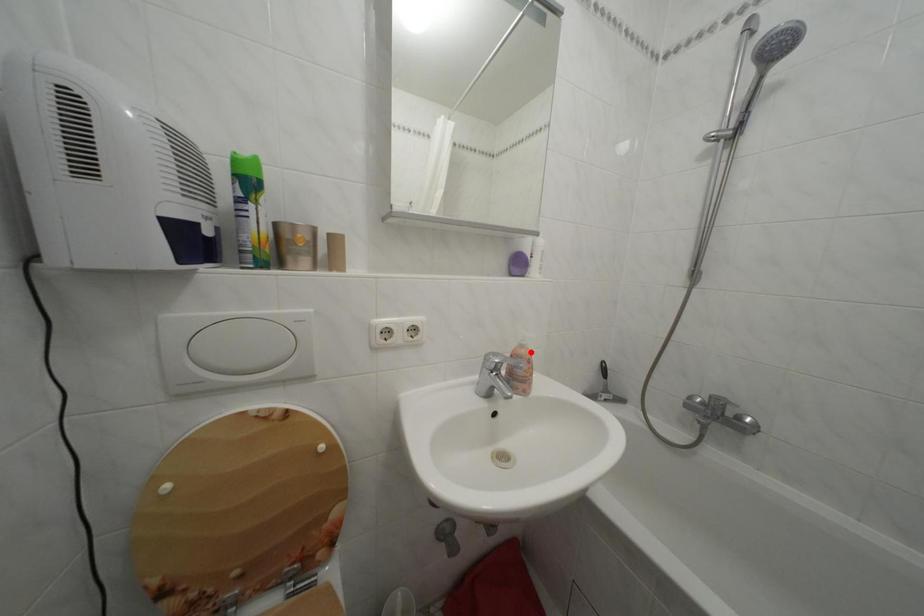
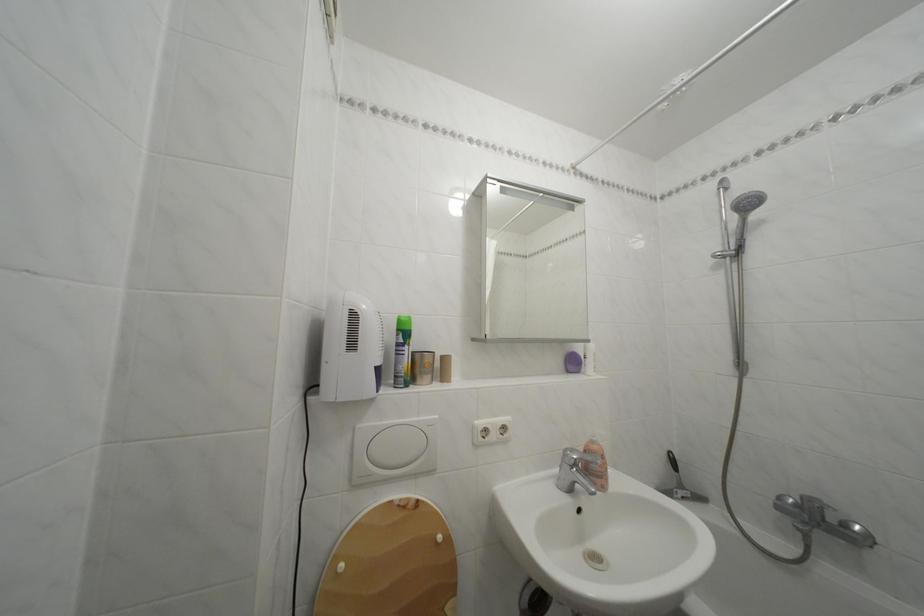
Where in the second image is the point corresponding to the highlighted location from the first image?

(602, 448)